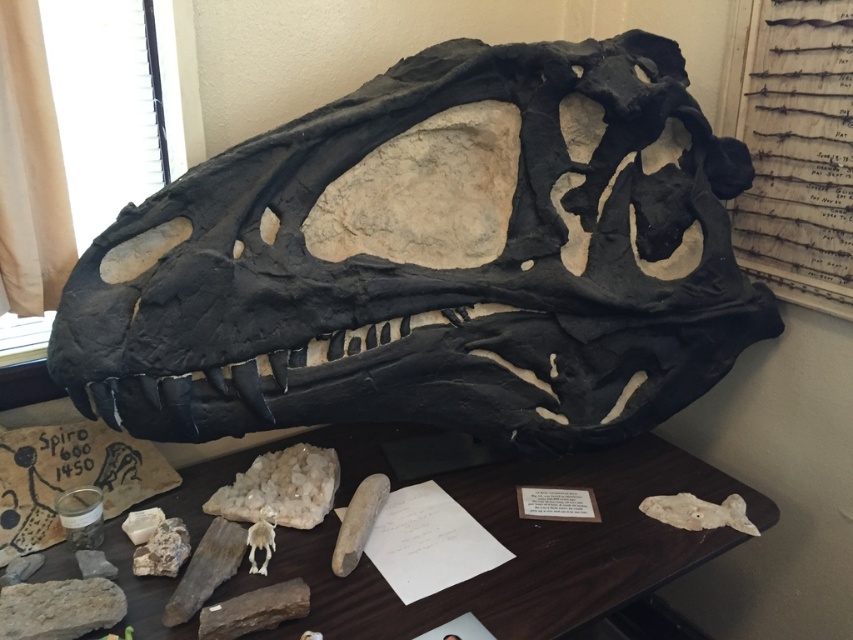
Which is below, matte black skull at center or white bone at center?

white bone at center is lower down.

Does point (425, 266) come closer to viewer compared to point (252, 528)?

No, it is behind (252, 528).

Find the location of a particular element. matte black skull at center is located at coordinates (433, 268).

You are a GUI agent. You are given a task and a screenshot of the screen. Output one action in this format:
    pyautogui.click(x=<x>, y=<y>)
    Task: Click on the matte black skull at center
    The height and width of the screenshot is (640, 853).
    Given the screenshot: What is the action you would take?
    pyautogui.click(x=433, y=268)

Does point (219, 177) lie behind point (360, 593)?

No, (219, 177) is closer to viewer.

Does matte black skull at center have a greater width compared to smooth wooden table at center?

In fact, matte black skull at center might be narrower than smooth wooden table at center.

Where is `matte black skull at center`? This screenshot has height=640, width=853. matte black skull at center is located at coordinates (433, 268).

I want to click on matte black skull at center, so click(433, 268).

Is smooth wooden table at center wider than white bone at center?

Indeed, smooth wooden table at center has a greater width compared to white bone at center.

Is smooth wooden table at center taller than white bone at center?

Correct, smooth wooden table at center is much taller as white bone at center.

Identify the location of smooth wooden table at center. This screenshot has width=853, height=640. (524, 550).